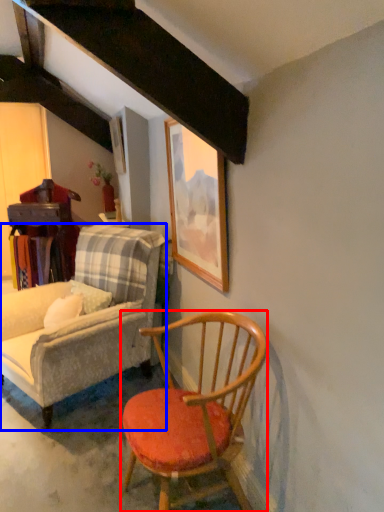
Question: Which object is further to the camera taking this photo, chair (highlighted by a red box) or chair (highlighted by a blue box)?

Choices:
 (A) chair
 (B) chair

Answer: (B)